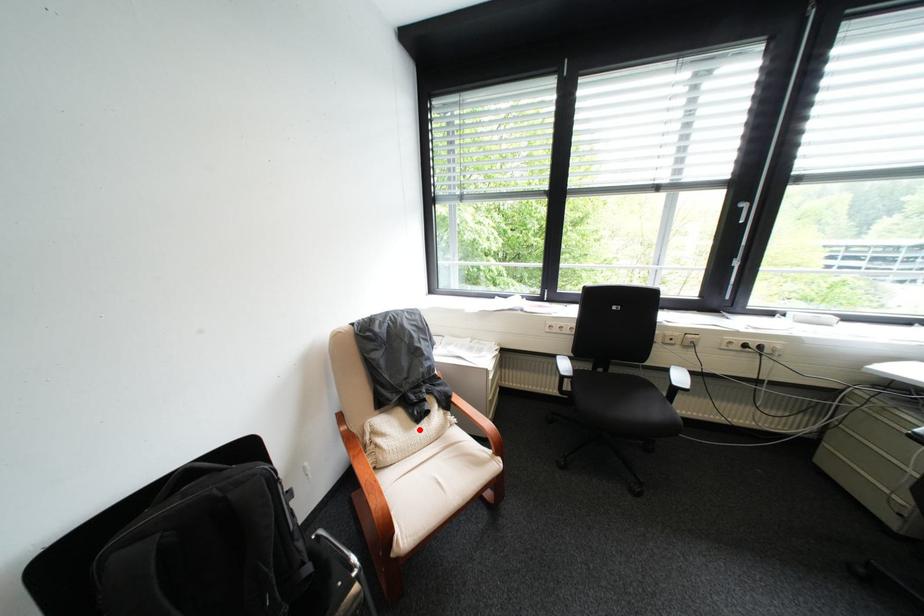
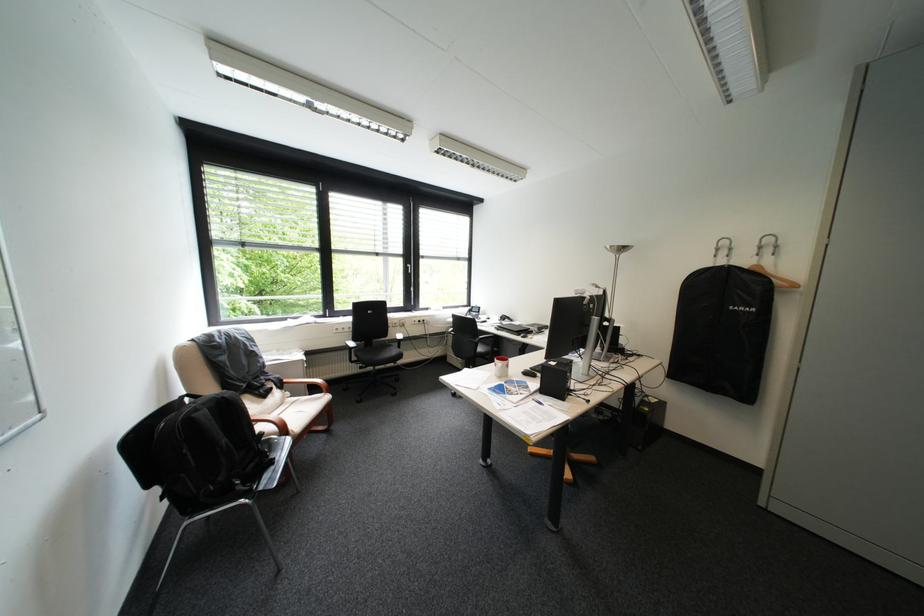
Question: A red point is marked in image1. In image2, is the corresponding 3D point closer to the camera or farther? Reply with the corresponding letter.

Choices:
 (A) The corresponding 3D point is closer.
 (B) The corresponding 3D point is farther.

Answer: (A)